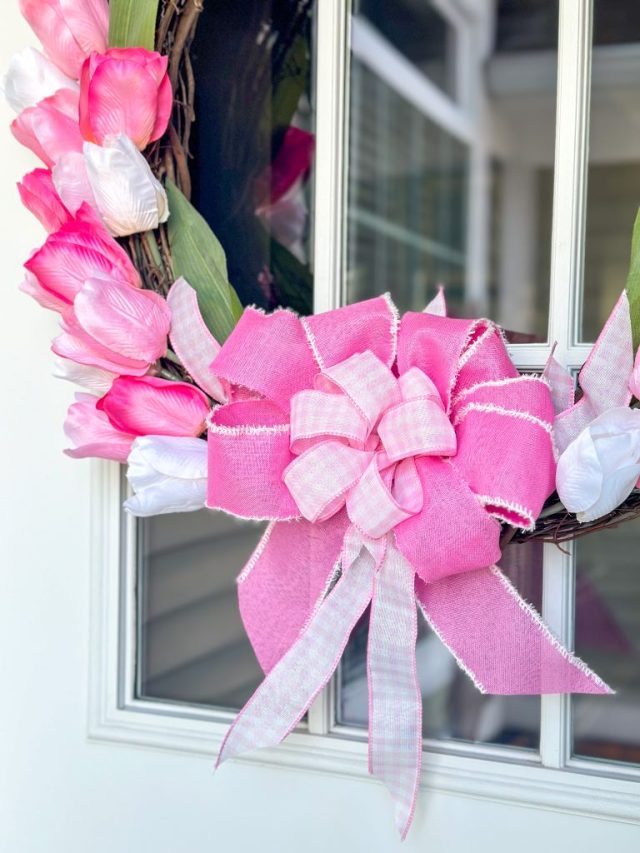
At what (x,y) coordinates should I click in order to perform the action: click on window pane. Please return your answer as a coordinate pair (x, y). The height and width of the screenshot is (853, 640). Looking at the image, I should click on (319, 153), (576, 193), (553, 599), (320, 711), (317, 750).